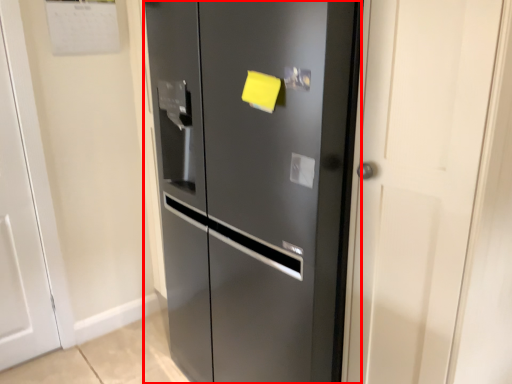
Question: Considering the relative positions of door (annotated by the red box) and door in the image provided, where is door (annotated by the red box) located with respect to the staircase?

Choices:
 (A) right
 (B) left

Answer: (A)